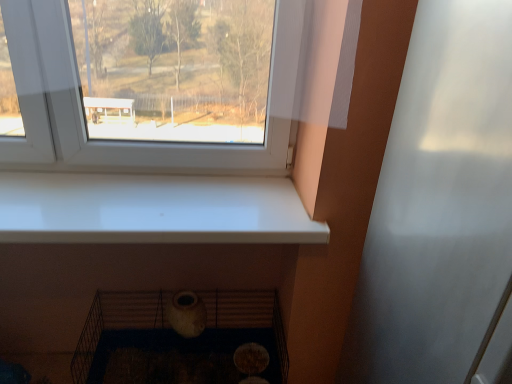
Question: From a real-world perspective, is matte ceramic vase at lower center located higher than transparent plastic screen door at right?

Choices:
 (A) no
 (B) yes

Answer: (A)

Question: Can transparent plastic screen door at right be found inside matte ceramic vase at lower center?

Choices:
 (A) no
 (B) yes

Answer: (A)

Question: From the image's perspective, is matte ceramic vase at lower center over transparent plastic screen door at right?

Choices:
 (A) no
 (B) yes

Answer: (A)

Question: Is matte ceramic vase at lower center to the left of transparent plastic screen door at right from the viewer's perspective?

Choices:
 (A) no
 (B) yes

Answer: (B)

Question: Is matte ceramic vase at lower center taller than transparent plastic screen door at right?

Choices:
 (A) yes
 (B) no

Answer: (B)

Question: Can you confirm if matte ceramic vase at lower center is thinner than transparent plastic screen door at right?

Choices:
 (A) no
 (B) yes

Answer: (B)

Question: From the image's perspective, is transparent plastic screen door at right located above matte ceramic vase at lower center?

Choices:
 (A) no
 (B) yes

Answer: (B)

Question: Can you confirm if transparent plastic screen door at right is wider than matte ceramic vase at lower center?

Choices:
 (A) yes
 (B) no

Answer: (A)

Question: Is transparent plastic screen door at right looking in the opposite direction of matte ceramic vase at lower center?

Choices:
 (A) no
 (B) yes

Answer: (A)

Question: From a real-world perspective, is transparent plastic screen door at right positioned under matte ceramic vase at lower center based on gravity?

Choices:
 (A) yes
 (B) no

Answer: (B)

Question: Considering the relative sizes of transparent plastic screen door at right and matte ceramic vase at lower center in the image provided, is transparent plastic screen door at right shorter than matte ceramic vase at lower center?

Choices:
 (A) yes
 (B) no

Answer: (B)

Question: Considering the relative positions of transparent plastic screen door at right and matte ceramic vase at lower center in the image provided, is transparent plastic screen door at right to the right of matte ceramic vase at lower center from the viewer's perspective?

Choices:
 (A) no
 (B) yes

Answer: (B)

Question: Considering the positions of transparent plastic screen door at right and matte ceramic vase at lower center in the image, is transparent plastic screen door at right taller or shorter than matte ceramic vase at lower center?

Choices:
 (A) tall
 (B) short

Answer: (A)